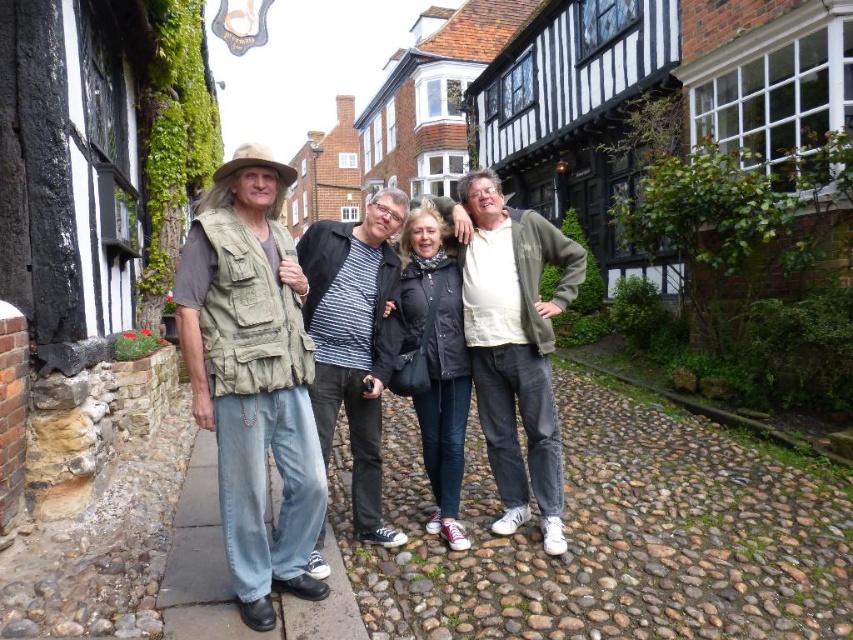
From the picture: Where is the denim jeans at center located in the image?

The denim jeans at center is located at point (276,369) in the image.

In the scene shown: In the scene where four people are standing on a cobblestone street surrounded by historic buildings, there are two items of clothing at the center of the image. The first is denim jeans at center, and the second is black leather jacket at center. From the perspective of someone facing the group, which clothing item is positioned to the left?

The denim jeans at center are to the left of the black leather jacket at center.